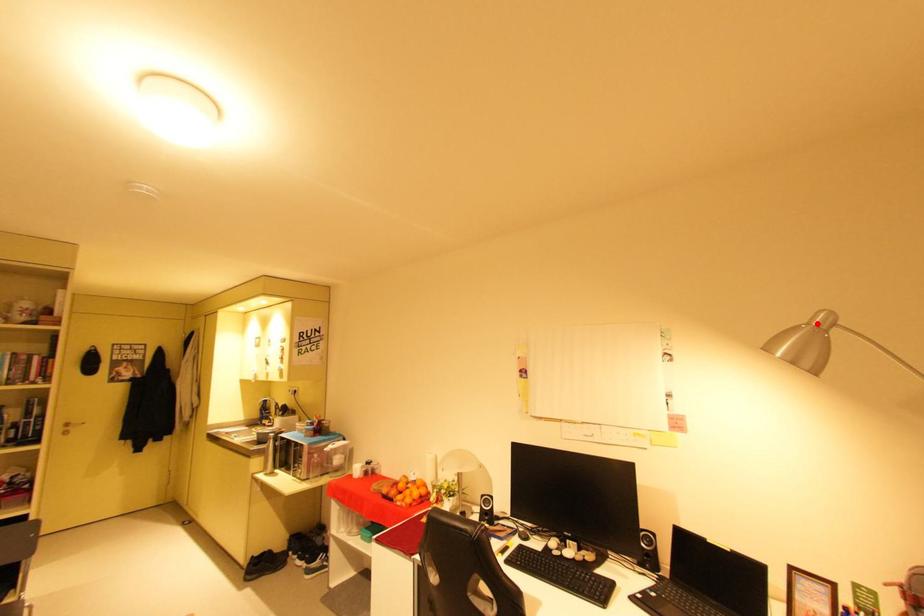
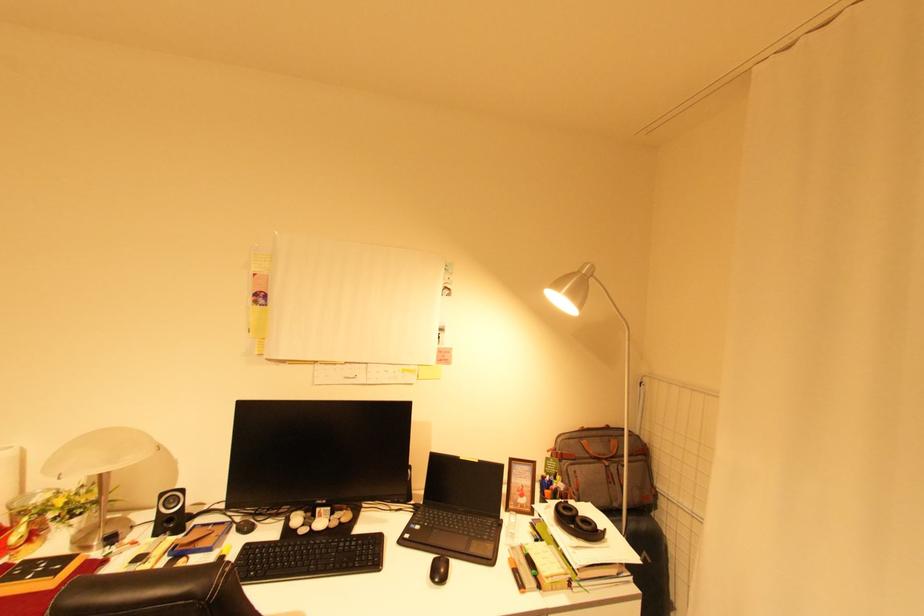
Find the pixel in the second image that matches the highlighted location in the first image.

(587, 273)